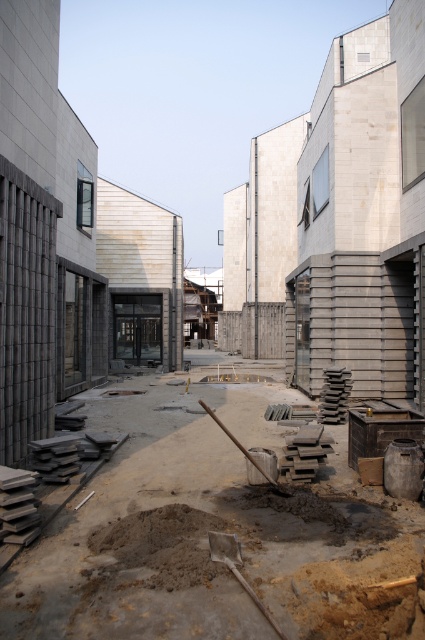
Can you confirm if brown concrete at center is positioned to the right of metallic silver shovel at center?

Incorrect, brown concrete at center is not on the right side of metallic silver shovel at center.

Is brown concrete at center shorter than metallic silver shovel at center?

In fact, brown concrete at center may be taller than metallic silver shovel at center.

Where is `brown concrete at center`? This screenshot has height=640, width=425. brown concrete at center is located at coordinates coord(210,529).

Which of these two, brown concrete at center or wooden shovel at center, stands shorter?

wooden shovel at center

Who is more forward, (79, 566) or (252, 458)?

Point (79, 566)

You are a GUI agent. You are given a task and a screenshot of the screen. Output one action in this format:
    pyautogui.click(x=<x>, y=<y>)
    Task: Click on the brown concrete at center
    The height and width of the screenshot is (640, 425).
    Given the screenshot: What is the action you would take?
    pyautogui.click(x=210, y=529)

Who is more distant from viewer, (x=238, y=579) or (x=277, y=488)?

Result: The point (x=277, y=488) is more distant.

Find the location of `metallic silver shovel at center`. metallic silver shovel at center is located at coordinates (237, 568).